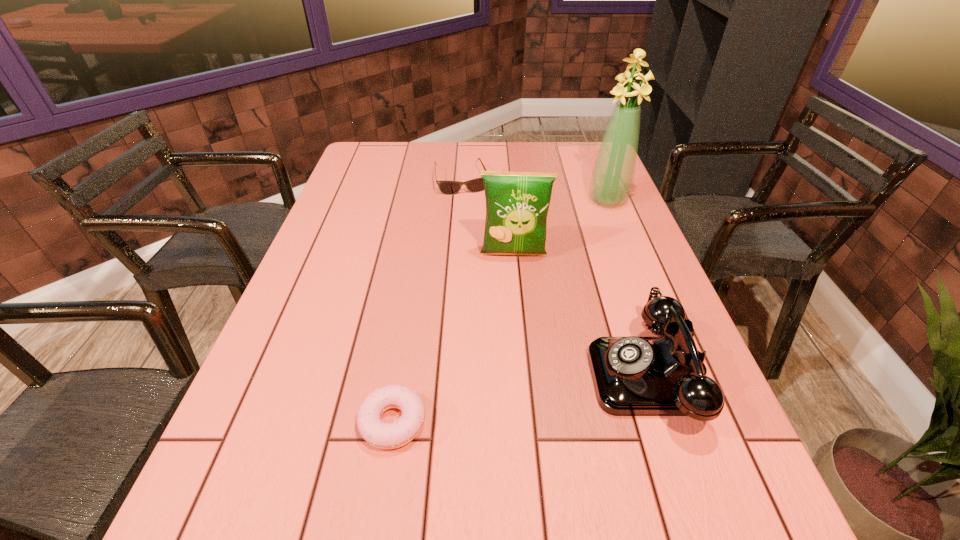
At what (x,y) coordinates should I click in order to perform the action: click on free point between the doughnut and the sunglasses. Please return your answer as a coordinate pair (x, y). The width and height of the screenshot is (960, 540). Looking at the image, I should click on (427, 301).

Where is `vacant space that is in between the telephone and the tallest object`? This screenshot has height=540, width=960. vacant space that is in between the telephone and the tallest object is located at coordinates (629, 287).

You are a GUI agent. You are given a task and a screenshot of the screen. Output one action in this format:
    pyautogui.click(x=<x>, y=<y>)
    Task: Click on the vacant space that is in between the sunglasses and the doughnut
    The width and height of the screenshot is (960, 540).
    Given the screenshot: What is the action you would take?
    pyautogui.click(x=427, y=301)

Image resolution: width=960 pixels, height=540 pixels. What are the coordinates of `free point between the tallest object and the doughnut` in the screenshot? It's located at (500, 312).

Find the location of a particular element. This screenshot has height=540, width=960. vacant space that's between the second tallest object and the bouquet is located at coordinates (561, 228).

You are a GUI agent. You are given a task and a screenshot of the screen. Output one action in this format:
    pyautogui.click(x=<x>, y=<y>)
    Task: Click on the vacant area that lies between the tallest object and the doughnut
    
    Given the screenshot: What is the action you would take?
    pyautogui.click(x=500, y=312)

Where is `free point between the tallest object and the telephone`? This screenshot has width=960, height=540. free point between the tallest object and the telephone is located at coordinates (629, 287).

Identify the location of empty location between the sunglasses and the doughnut. This screenshot has width=960, height=540. (427, 301).

Locate an element on the screen. object that stands as the closest to the doughnut is located at coordinates (633, 376).

Locate an element on the screen. The width and height of the screenshot is (960, 540). object that can be found as the third closest to the second tallest object is located at coordinates (475, 185).